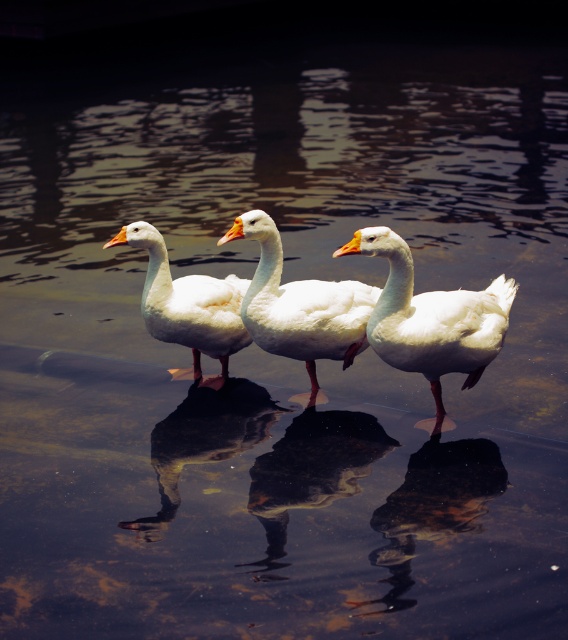
Consider the image. Between white glossy swan at center and white matte goose at center, which one is positioned higher?

white matte goose at center is above.

The width and height of the screenshot is (568, 640). Identify the location of white glossy swan at center. [299, 305].

In the scene shown: Is the position of white glossy duck at center less distant than that of white glossy swan at center?

Yes, it is.

Image resolution: width=568 pixels, height=640 pixels. Identify the location of white glossy duck at center. (310, 474).

Where is `white glossy duck at center`? Image resolution: width=568 pixels, height=640 pixels. white glossy duck at center is located at coordinates (310, 474).

Is white glossy duck at center taller than white matte goose at center?

In fact, white glossy duck at center may be shorter than white matte goose at center.

Which of these two, white glossy duck at center or white matte goose at center, stands shorter?

white glossy duck at center is shorter.

You are a GUI agent. You are given a task and a screenshot of the screen. Output one action in this format:
    pyautogui.click(x=<x>, y=<y>)
    Task: Click on the white glossy duck at center
    The image size is (568, 640).
    Given the screenshot: What is the action you would take?
    pyautogui.click(x=310, y=474)

Where is `white glossy duck at center`? The width and height of the screenshot is (568, 640). white glossy duck at center is located at coordinates (310, 474).